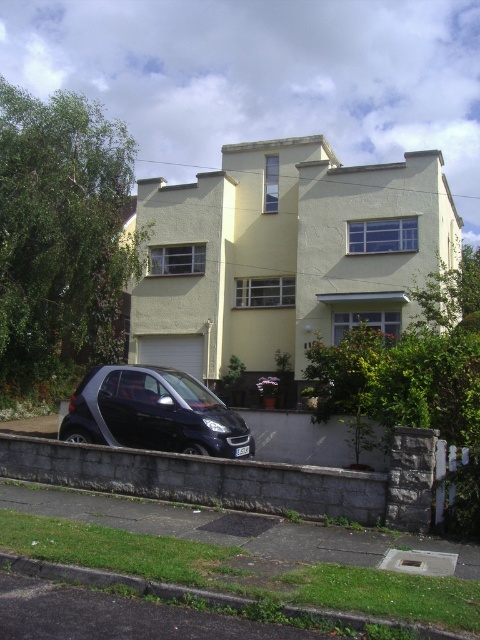
You are standing at the point marked by the coordinates point (154, 413). Looking around, you see the shiny black car at lower left. What is the nearest object to you?

The nearest object to you is the shiny black car at lower left because you are standing on it at point (154, 413).

You are a delivery person trying to park your van near the gray concrete curb at lower center and the green grass at lower left. Based on the scene, which object is closer to the road?

The gray concrete curb at lower center is closer to the road because it is positioned to the right of the green grass at lower left, which is typically where curbs are located relative to grassy areas.